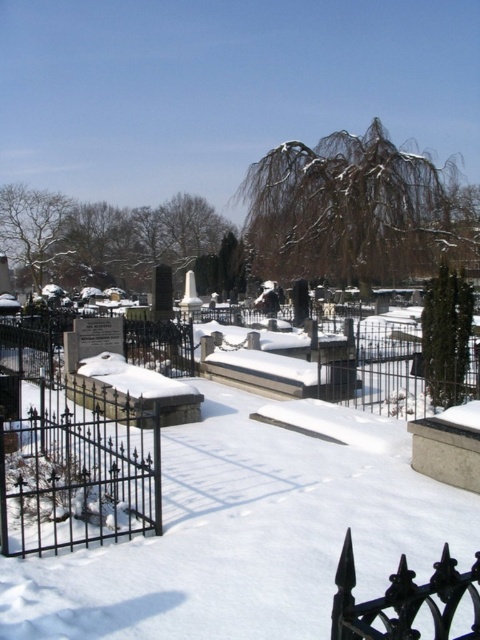
Which is behind, point (7, 566) or point (84, 538)?

The point (84, 538) is behind.

What do you see at coordinates (227, 540) in the screenshot?
I see `white powdery snow at center` at bounding box center [227, 540].

In order to click on white powdery snow at center in this screenshot , I will do `click(227, 540)`.

Does white powdery snow at center have a smaller size compared to black wrought iron fence at lower right?

Incorrect, white powdery snow at center is not smaller in size than black wrought iron fence at lower right.

Is the position of white powdery snow at center more distant than that of black wrought iron fence at lower right?

Yes, white powdery snow at center is behind black wrought iron fence at lower right.

In order to click on white powdery snow at center in this screenshot , I will do `click(227, 540)`.

Is black wrought iron fence at lower left wider than black wrought iron fence at lower right?

Yes, black wrought iron fence at lower left is wider than black wrought iron fence at lower right.

Does black wrought iron fence at lower left have a smaller size compared to black wrought iron fence at lower right?

Actually, black wrought iron fence at lower left might be larger than black wrought iron fence at lower right.

Does point (124, 506) lie behind point (475, 632)?

That is True.

Find the location of a particular element. black wrought iron fence at lower left is located at coordinates (75, 476).